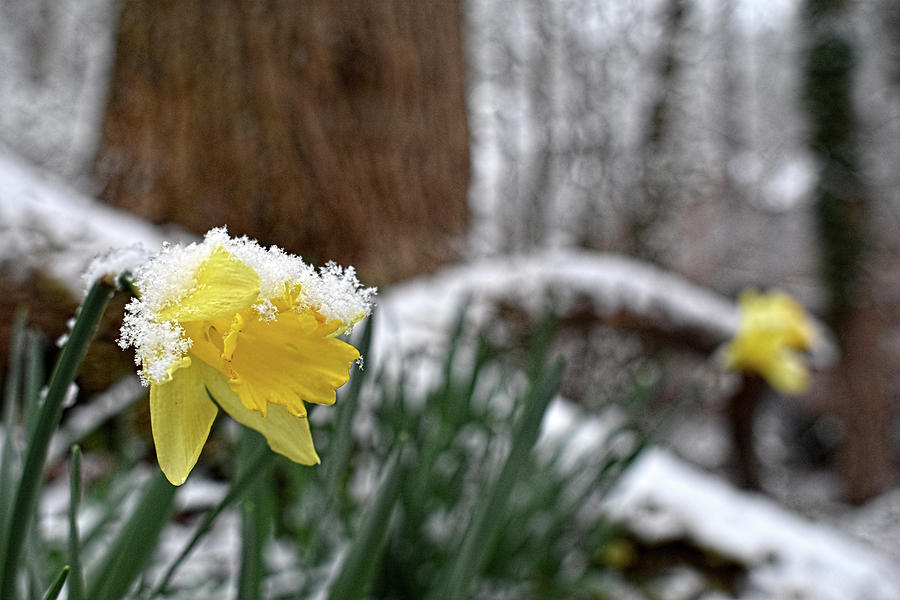
Locate an element on the screen. The height and width of the screenshot is (600, 900). receptacle is located at coordinates (240, 349).